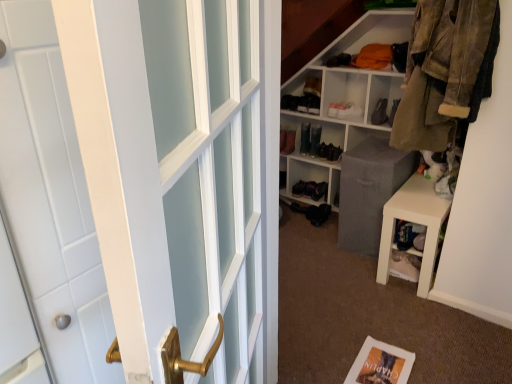
Find the location of a particular element. Image resolution: width=512 pixels, height=384 pixels. free spot in front of white matte stool at lower right is located at coordinates (428, 321).